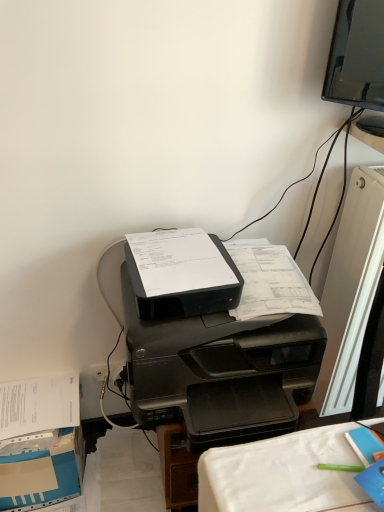
Question: Does blue cardboard box at lower left lie in front of black plastic printer at center?

Choices:
 (A) no
 (B) yes

Answer: (A)

Question: Is blue cardboard box at lower left positioned with its back to black plastic printer at center?

Choices:
 (A) no
 (B) yes

Answer: (A)

Question: Is blue cardboard box at lower left behind black plastic printer at center?

Choices:
 (A) no
 (B) yes

Answer: (B)

Question: Does blue cardboard box at lower left turn towards black plastic printer at center?

Choices:
 (A) no
 (B) yes

Answer: (A)

Question: From the image's perspective, would you say blue cardboard box at lower left is positioned over black plastic printer at center?

Choices:
 (A) no
 (B) yes

Answer: (A)

Question: From the image's perspective, relative to white plastic radiator at right, is black plastic printer at center above or below?

Choices:
 (A) above
 (B) below

Answer: (B)

Question: In the image, is black plastic printer at center positioned in front of or behind white plastic radiator at right?

Choices:
 (A) behind
 (B) front

Answer: (B)

Question: Based on their sizes in the image, would you say black plastic printer at center is bigger or smaller than white plastic radiator at right?

Choices:
 (A) big
 (B) small

Answer: (A)

Question: Considering the positions of point (309, 301) and point (362, 300), is point (309, 301) closer or farther from the camera than point (362, 300)?

Choices:
 (A) farther
 (B) closer

Answer: (B)

Question: Is white plastic radiator at right taller or shorter than black plastic printer at center?

Choices:
 (A) tall
 (B) short

Answer: (A)

Question: Looking at the image, does white plastic radiator at right seem bigger or smaller compared to black plastic printer at center?

Choices:
 (A) small
 (B) big

Answer: (A)

Question: In the image, is white plastic radiator at right positioned in front of or behind black plastic printer at center?

Choices:
 (A) front
 (B) behind

Answer: (B)

Question: Considering the relative positions of white plastic radiator at right and black plastic printer at center in the image provided, is white plastic radiator at right to the left or to the right of black plastic printer at center?

Choices:
 (A) left
 (B) right

Answer: (B)

Question: From their relative heights in the image, would you say blue cardboard box at lower left is taller or shorter than black plastic printer at center?

Choices:
 (A) tall
 (B) short

Answer: (B)

Question: From a real-world perspective, relative to black plastic printer at center, is blue cardboard box at lower left vertically above or below?

Choices:
 (A) above
 (B) below

Answer: (B)